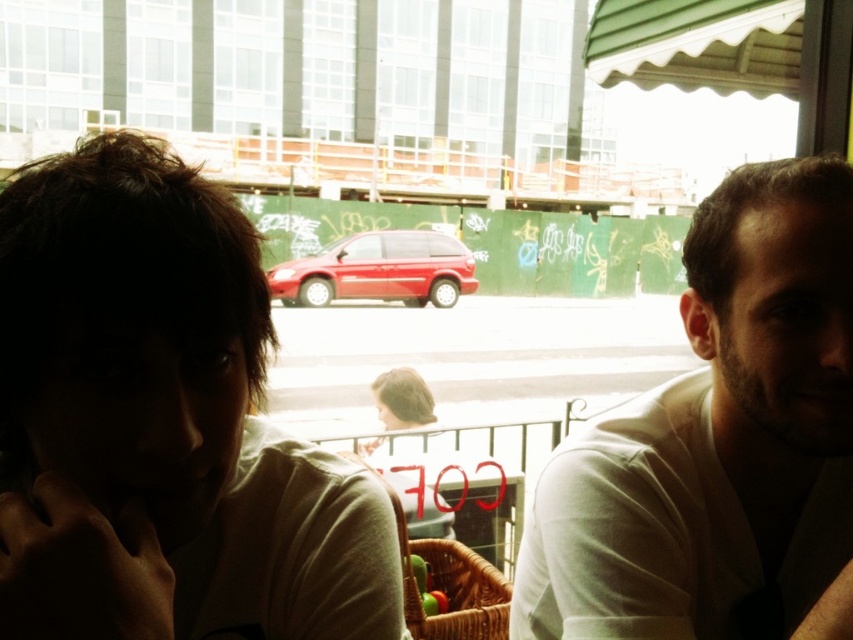
You are standing at the entrance of the cafe and want to locate the point marked as point (378, 269). Based on the scene, where would this point be located?

The point (378, 269) is on the matte red van at center.

You are sitting at the table in the foreground of the scene. You want to hand a napkin to the person with the white matte shirt at right and the person with the blonde hair at center. Which person will you need to reach across the table to give the napkin to?

The white matte shirt at right is closer to the viewer than the blonde hair at center, so you will need to reach across the table to give the napkin to the person with the blonde hair at center.